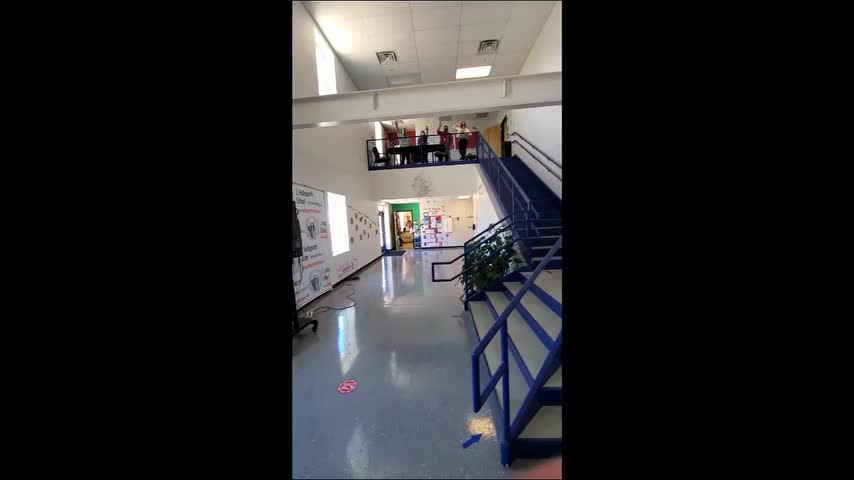
This screenshot has width=854, height=480. Find the location of `door/doorway to other room`. door/doorway to other room is located at coordinates (379, 234), (401, 222).